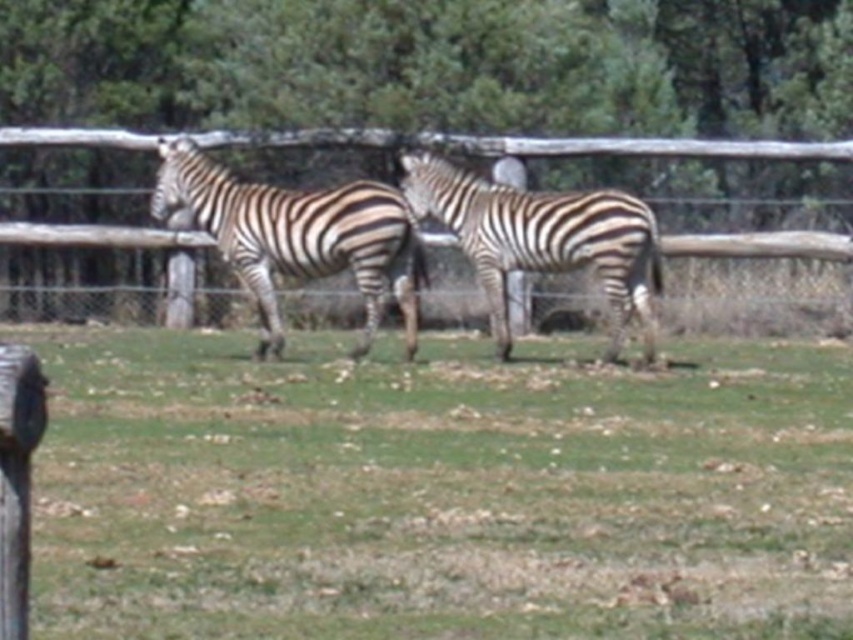
Question: Which object is positioned closest to the black and white striped zebra at left?

Choices:
 (A) black and white striped zebra at center
 (B) wooden fence at center

Answer: (A)

Question: Which point appears closest to the camera in this image?

Choices:
 (A) (257, 237)
 (B) (509, 220)
 (C) (161, 243)
 (D) (584, 604)

Answer: (D)

Question: Which is farther from the black and white striped zebra at center?

Choices:
 (A) black and white striped zebra at left
 (B) green grass at center

Answer: (B)

Question: Can you confirm if green grass at center is positioned to the left of wooden fence at center?

Choices:
 (A) yes
 (B) no

Answer: (A)

Question: Considering the relative positions of black and white striped zebra at left and wooden fence at center in the image provided, where is black and white striped zebra at left located with respect to wooden fence at center?

Choices:
 (A) left
 (B) right

Answer: (A)

Question: Can you confirm if black and white striped zebra at left is bigger than wooden fence at center?

Choices:
 (A) no
 (B) yes

Answer: (B)